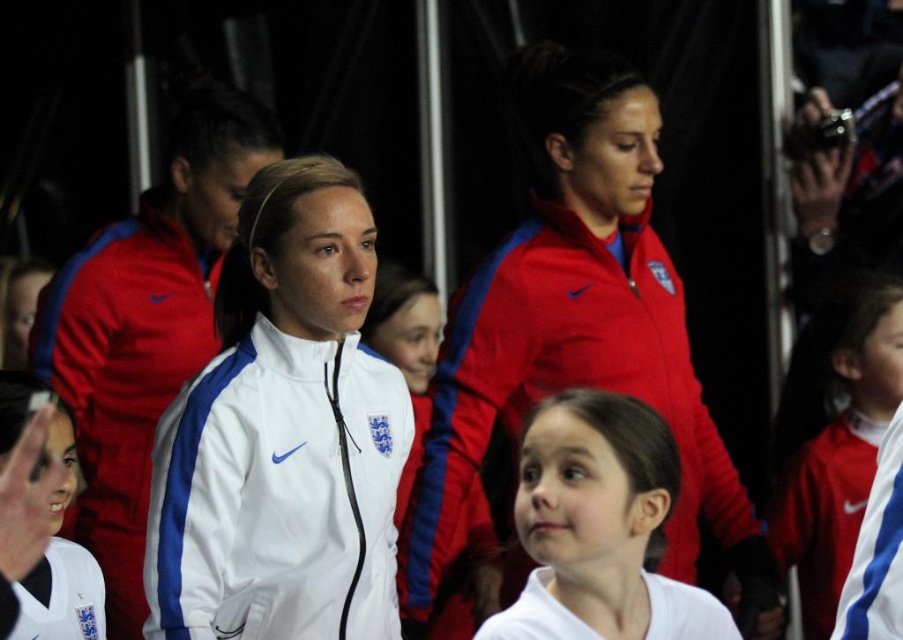
Question: Is matte red jacket at center thinner than white fabric jacket at center?

Choices:
 (A) no
 (B) yes

Answer: (A)

Question: Can you confirm if white matte jacket at center is positioned to the right of white fabric jacket at center?

Choices:
 (A) no
 (B) yes

Answer: (A)

Question: Which of the following is the farthest from the observer?

Choices:
 (A) white fabric jacket at center
 (B) matte red jacket at center
 (C) white matte shirt at center

Answer: (A)

Question: Does matte red jacket at center have a lesser width compared to white fabric jacket at center?

Choices:
 (A) yes
 (B) no

Answer: (B)

Question: Which object appears closest to the camera in this image?

Choices:
 (A) matte red jacket at center
 (B) white fabric jacket at center

Answer: (A)

Question: Based on their relative distances, which object is farther from the white fabric jacket at center?

Choices:
 (A) white matte jacket at center
 (B) matte red jacket at center
 (C) white matte shirt at center

Answer: (A)